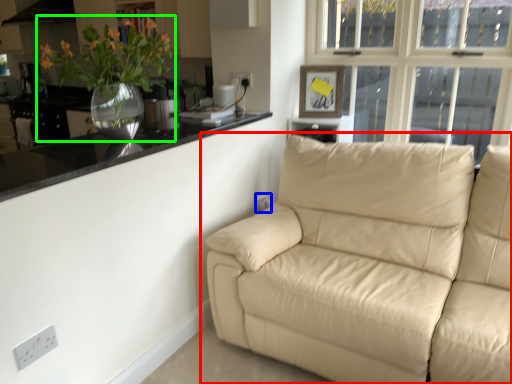
Question: Which is nearer to the studio couch (highlighted by a red box)? electric outlet (highlighted by a blue box) or houseplant (highlighted by a green box).

Choices:
 (A) electric outlet
 (B) houseplant

Answer: (A)